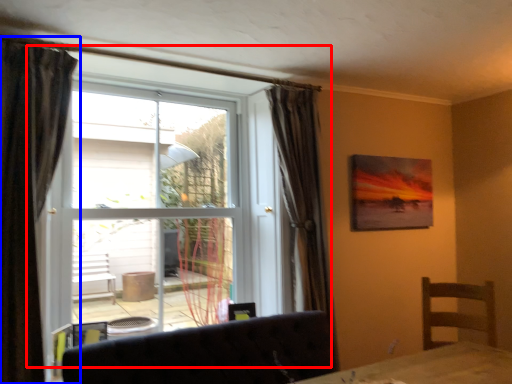
Question: Which point is further to the camera, window (highlighted by a red box) or curtain (highlighted by a blue box)?

Choices:
 (A) window
 (B) curtain

Answer: (A)